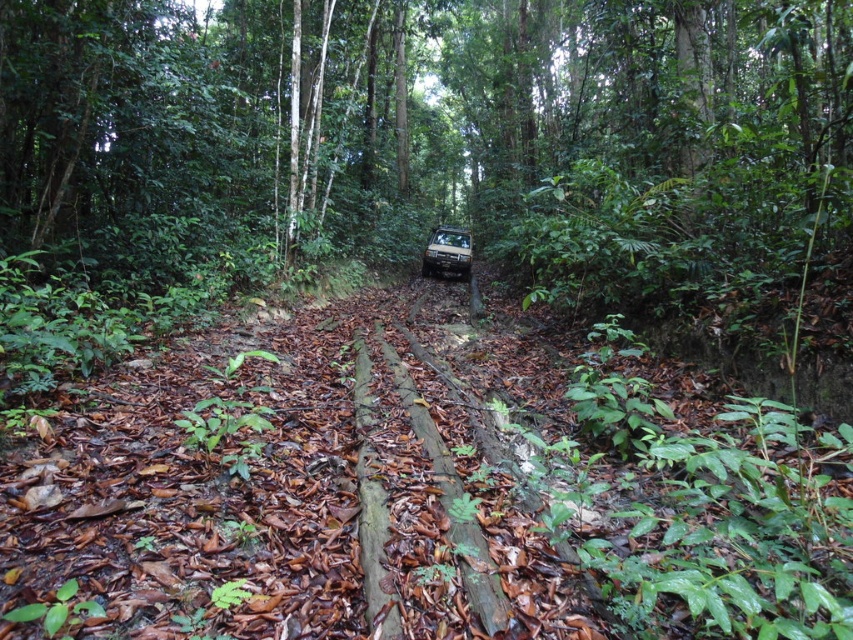
You are a hiker trying to walk along the narrow dirt path in the forest. You see a green leafy tree at center and a metallic silver suv at center. Which object is wider from your perspective?

The green leafy tree at center is wider than the metallic silver suv at center.

You are standing at the point marked as point [392,113] in the forest scene. What object is exactly at that location?

The green leafy tree at center is located at point [392,113].